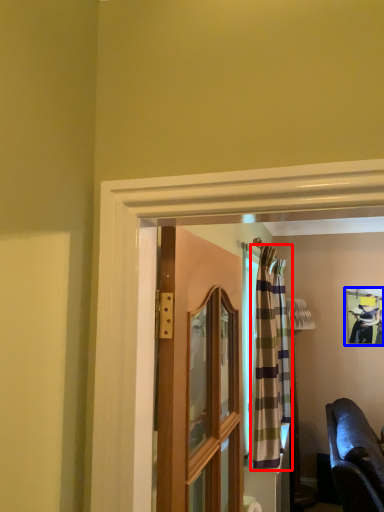
Question: Which point is further to the camera, curtain (highlighted by a red box) or picture frame (highlighted by a blue box)?

Choices:
 (A) curtain
 (B) picture frame

Answer: (B)